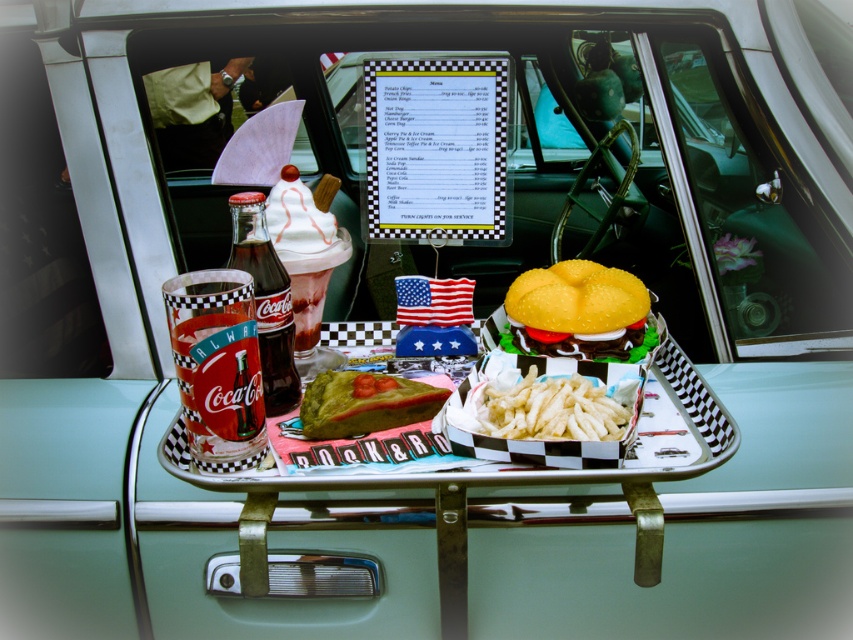
You are a guest at this retro event and want to grab something to eat. You notice two points marked on the tray. The first point is at coordinates point (234, 220) and the second is at point (500, 388). Which point is closer to you as you look at the tray from the front?

Point (234, 220) is in front of point (500, 388), so the first point is closer to you.